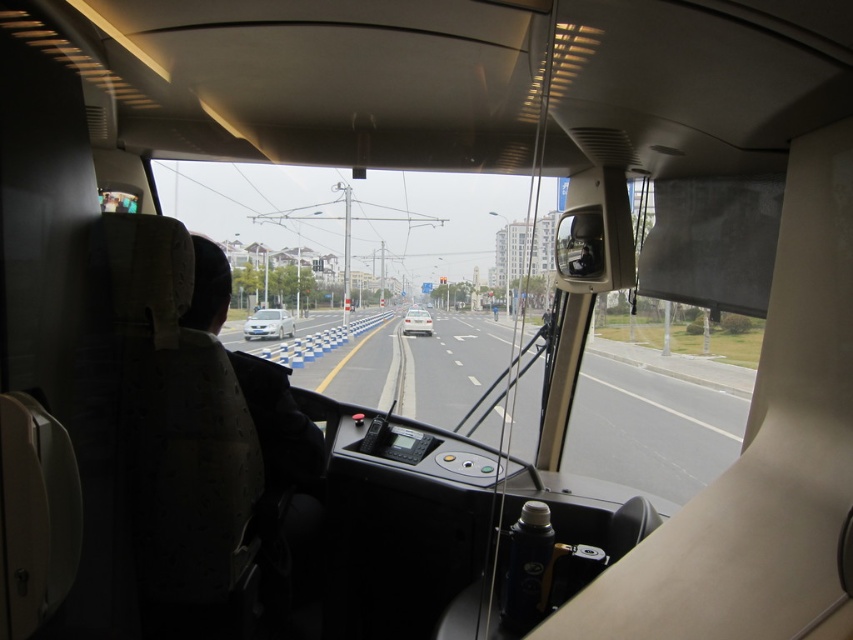
Question: Can you confirm if transparent glass windshield at center is wider than white matte car at center?

Choices:
 (A) yes
 (B) no

Answer: (A)

Question: Which point is closer to the camera?

Choices:
 (A) (196, 321)
 (B) (283, 337)
 (C) (445, 317)
 (D) (587, 419)

Answer: (A)

Question: Which point appears closest to the camera in this image?

Choices:
 (A) (419, 320)
 (B) (276, 317)
 (C) (259, 410)

Answer: (C)

Question: Which point is closer to the camera?

Choices:
 (A) (579, 404)
 (B) (503, 369)

Answer: (A)

Question: Does asphalt road at center have a lesser width compared to black fabric jacket at left?

Choices:
 (A) yes
 (B) no

Answer: (B)

Question: Can you confirm if transparent glass windshield at center is positioned below black fabric jacket at left?

Choices:
 (A) yes
 (B) no

Answer: (B)